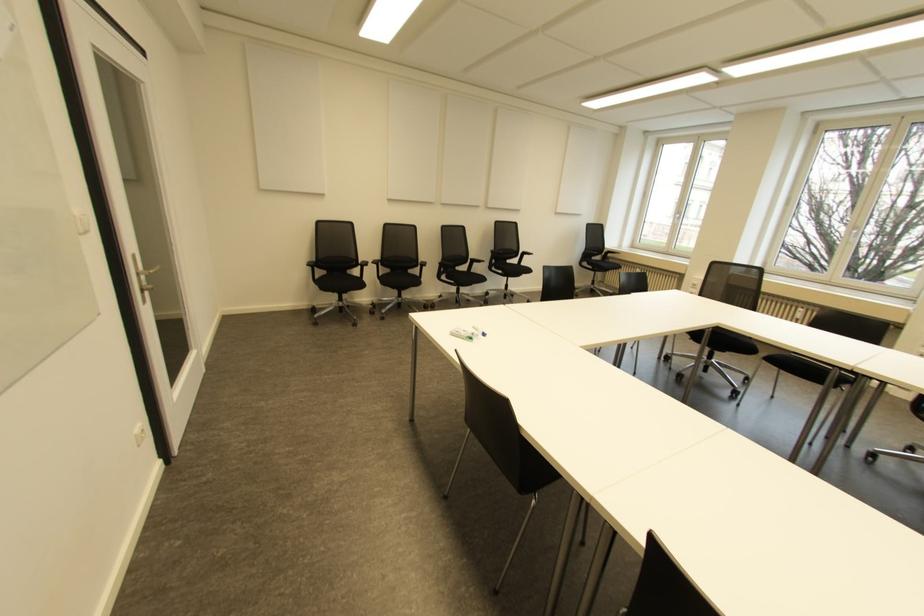
Identify the location of metal door handle. (142, 278).